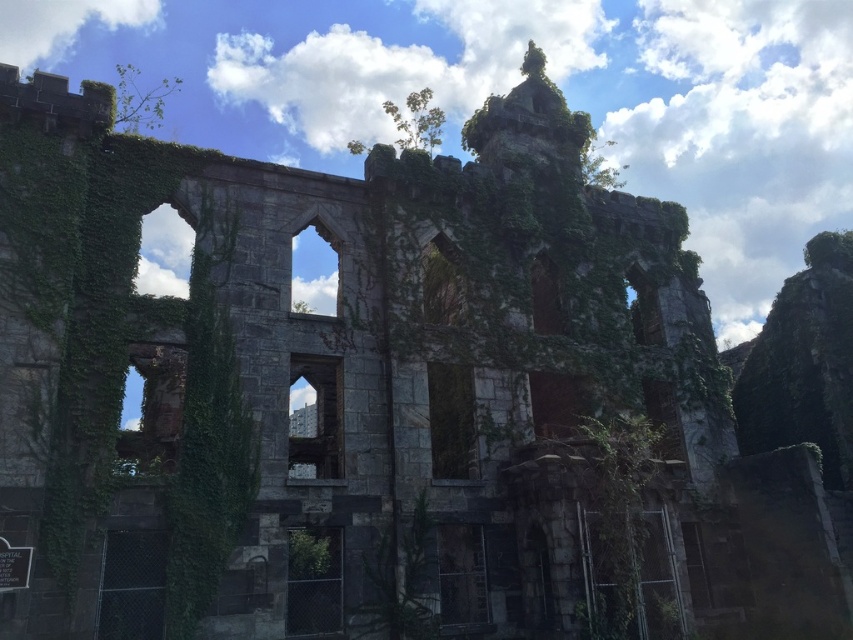
You are standing in front of the ruins and want to take a photo. You notice two points marked in the image. Which point, point (131, 118) or point (444, 118), is closer to your camera lens?

Point (131, 118) is further to the camera than point (444, 118). Therefore, point (444, 118) is closer to the camera lens.

You are standing at the camera position and want to take a photo of the green leafy tree at upper left. If your camera has a maximum zoom range of 50 feet, will you be able to capture the tree clearly without moving closer?

The green leafy tree at upper left and camera are 60.31 feet apart, which exceeds the camera maximum zoom range of 50 feet. So you need to move closer to capture the tree clearly.